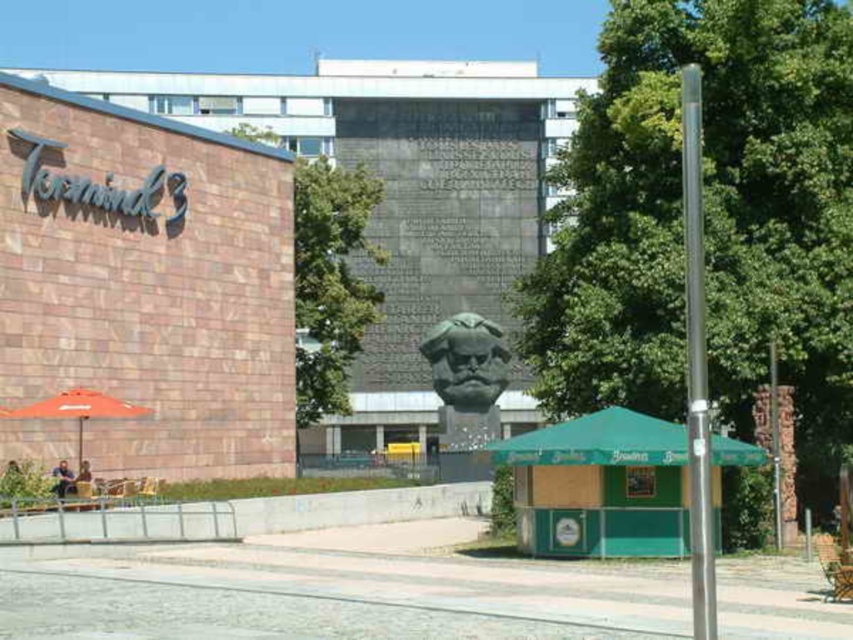
You are a tourist holding a map and want to take a photo of the matte brick mall at left and the orange fabric umbrella at lower left. Which object should you focus on first to ensure both are in the frame?

You should focus on the matte brick mall at left first because it is closer to you than the orange fabric umbrella at lower left, so adjusting the camera to include it will help ensure both are in the frame.

You are a window cleaner who needs to clean both the matte brick mall at left and the green polished stone bust at center. Which object will require you to climb higher to reach its top?

The matte brick mall at left is taller than the green polished stone bust at center, so you will need to climb higher to reach the top of the matte brick mall at left.

You are standing in the urban outdoor scene shown. You want to take a photo of the matte brick mall at left without including the sculpture in the frame. Is the sculpture too close to the mall to avoid in the shot?

The matte brick mall at left is 34.05 meters away from the camera. Since the sculpture is in the center of the image and the mall is on the left, the distance between them might be sufficient to avoid including the sculpture when focusing on the mall. However, without knowing the exact field of view of your camera, it is difficult to determine definitively. Consider adjusting your position or zoom level to frame the mall exclusively.